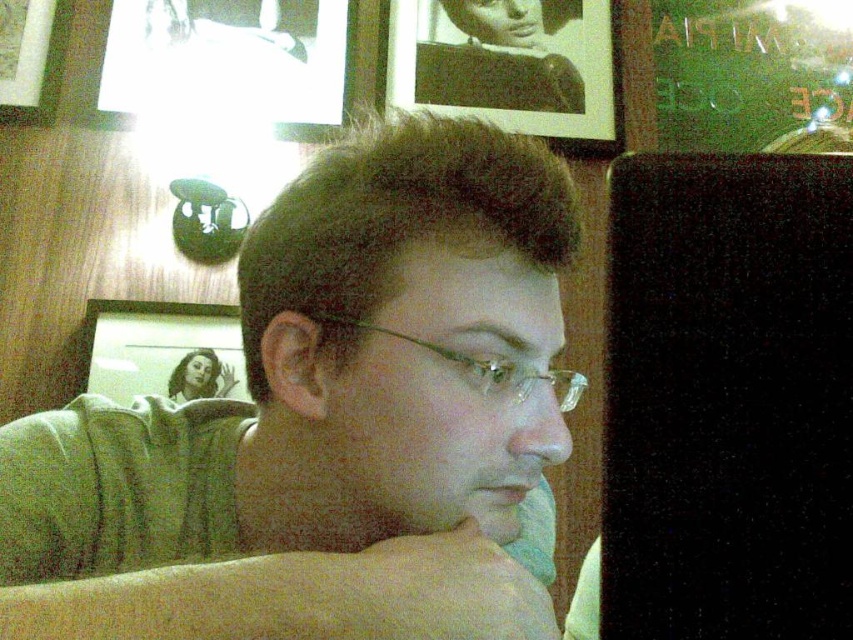
You are an interior designer planning to hang a new painting in the room. The current matte glass picture frame at upper left is at coordinates 0.548, 0.192. If you want to place the new painting 0.3 meters to the right and 0.2 meters below the existing frame, what are the new coordinates?

The new coordinates would be calculated by adding 0.3 to the x coordinate and 0.2 to the y coordinate of the matte glass picture frame at upper left. The new coordinates are (163, 349) plus 0.3 and 0.2 respectively, resulting in (334, 541).

You are a photographer trying to capture a closeup of the clear plastic glasses at center without including the matte glass picture frame at upper left. Given their sizes, is this possible?

The matte glass picture frame at upper left is larger than the clear plastic glasses at center. Since the frame is larger, it might be challenging to avoid capturing it in the background if the glasses are centered. Adjusting the camera angle or moving closer to the glasses could help isolate them from the frame.